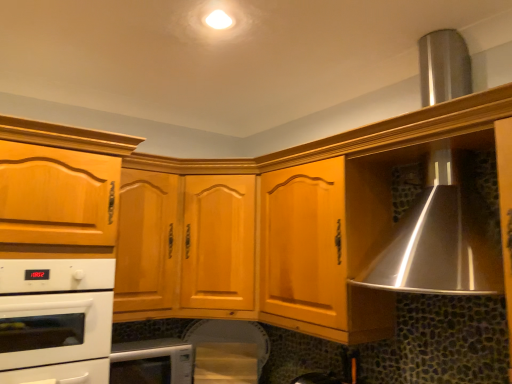
Question: Considering the relative sizes of matte wood cabinet at left, acting as the second cabinetry starting from the right, and white glossy microwave at lower center, the second home appliance positioned from the top, in the image provided, is matte wood cabinet at left, acting as the second cabinetry starting from the right, taller than white glossy microwave at lower center, the second home appliance positioned from the top,?

Choices:
 (A) yes
 (B) no

Answer: (A)

Question: Does matte wood cabinet at left, the first cabinetry positioned from the left, appear on the left side of white glossy microwave at lower center, which is the first home appliance from bottom to top?

Choices:
 (A) yes
 (B) no

Answer: (A)

Question: Is matte wood cabinet at left, acting as the second cabinetry starting from the right, outside of white glossy microwave at lower center, which is the first home appliance from bottom to top?

Choices:
 (A) yes
 (B) no

Answer: (A)

Question: From the image's perspective, is matte wood cabinet at left, the first cabinetry positioned from the left, located above white glossy microwave at lower center, which is the first home appliance from bottom to top?

Choices:
 (A) yes
 (B) no

Answer: (A)

Question: Can you confirm if matte wood cabinet at left, acting as the second cabinetry starting from the right, is bigger than white glossy microwave at lower center, the second home appliance positioned from the top?

Choices:
 (A) no
 (B) yes

Answer: (B)

Question: From a real-world perspective, is matte wood cabinet at left, acting as the second cabinetry starting from the right, positioned over white glossy microwave at lower center, the second home appliance positioned from the top, based on gravity?

Choices:
 (A) no
 (B) yes

Answer: (B)

Question: Does matte wood cabinet at left, the first cabinetry positioned from the left, have a greater height compared to light brown wood cabinet at center, acting as the 1th cabinetry starting from the right?

Choices:
 (A) yes
 (B) no

Answer: (A)

Question: From a real-world perspective, is matte wood cabinet at left, acting as the second cabinetry starting from the right, under light brown wood cabinet at center, which appears as the second cabinetry when viewed from the left?

Choices:
 (A) no
 (B) yes

Answer: (B)

Question: Is matte wood cabinet at left, the first cabinetry positioned from the left, shorter than light brown wood cabinet at center, which appears as the second cabinetry when viewed from the left?

Choices:
 (A) yes
 (B) no

Answer: (B)

Question: From a real-world perspective, is matte wood cabinet at left, acting as the second cabinetry starting from the right, positioned over light brown wood cabinet at center, acting as the 1th cabinetry starting from the right, based on gravity?

Choices:
 (A) yes
 (B) no

Answer: (B)

Question: Is matte wood cabinet at left, acting as the second cabinetry starting from the right, bigger than light brown wood cabinet at center, acting as the 1th cabinetry starting from the right?

Choices:
 (A) no
 (B) yes

Answer: (A)

Question: Is matte wood cabinet at left, acting as the second cabinetry starting from the right, at the right side of light brown wood cabinet at center, which appears as the second cabinetry when viewed from the left?

Choices:
 (A) yes
 (B) no

Answer: (B)

Question: Does white glossy microwave at lower center, the second home appliance positioned from the top, have a greater height compared to matte wood cabinet at left, acting as the second cabinetry starting from the right?

Choices:
 (A) yes
 (B) no

Answer: (B)